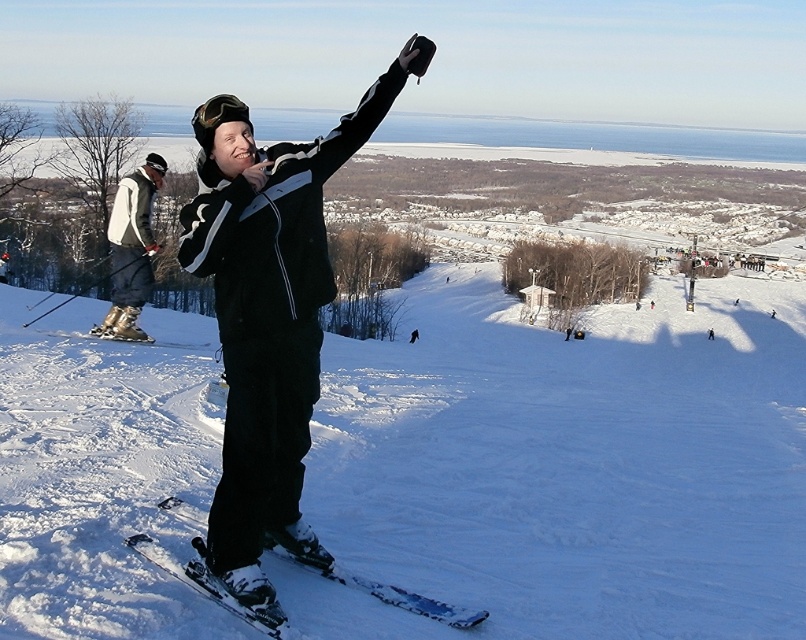
You are a winter sports enthusiast who wants to carry both the matte black snowboard at center and the shiny metallic skis at center in your backpack. Your backpack has a width of 1 meter. Can you fit both items side by side in your backpack?

The matte black snowboard at center and shiny metallic skis at center are 1.01 meters apart, so they cannot be placed side by side in a backpack with a width of 1 meter since the combined width exceeds the backpack capacity.

You are a photographer trying to capture a wide shot of the matte black snowboard at center while also including the camera in the frame. Given their distance, will you need to adjust your position or zoom level to include both?

The matte black snowboard at center and camera are 3.63 meters apart. To capture both in a single wide shot, you may need to either move closer to reduce the distance between them or adjust your zoom level to a wider angle to encompass both objects within the frame.